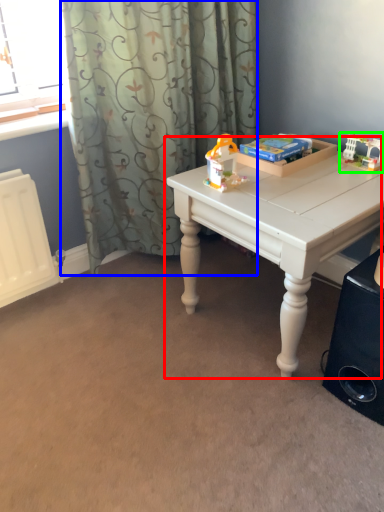
Question: Estimate the real-world distances between objects in this image. Which object is farther from table (highlighted by a red box), curtain (highlighted by a blue box) or toy (highlighted by a green box)?

Choices:
 (A) curtain
 (B) toy

Answer: (A)